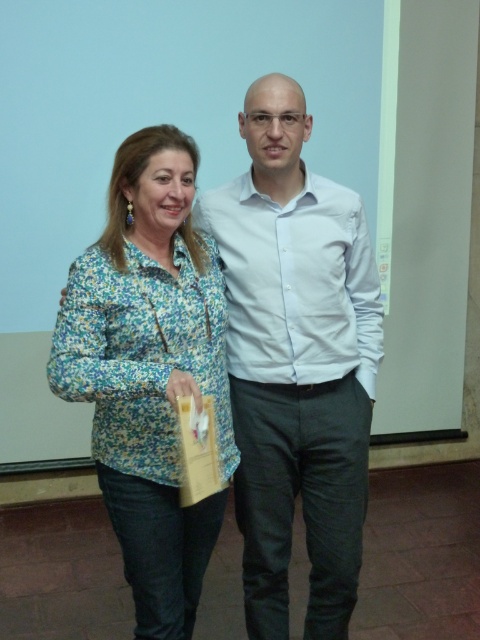
Question: Does white smooth shirt at center have a lesser width compared to floral fabric jacket at left?

Choices:
 (A) yes
 (B) no

Answer: (B)

Question: Which point is farther to the camera?

Choices:
 (A) (264, 317)
 (B) (132, 186)

Answer: (A)

Question: Is white smooth shirt at center behind floral fabric jacket at left?

Choices:
 (A) yes
 (B) no

Answer: (A)

Question: From the image, what is the correct spatial relationship of white smooth shirt at center in relation to floral fabric jacket at left?

Choices:
 (A) left
 (B) right

Answer: (B)